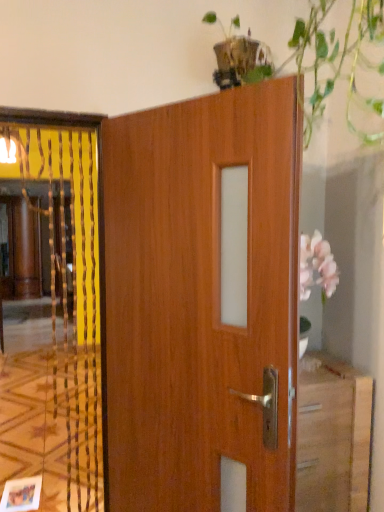
Question: From a real-world perspective, is wooden elevator at left on wooden door at center?

Choices:
 (A) no
 (B) yes

Answer: (A)

Question: Can you confirm if wooden elevator at left is positioned to the right of wooden door at center?

Choices:
 (A) no
 (B) yes

Answer: (A)

Question: Considering the relative sizes of wooden elevator at left and wooden door at center in the image provided, is wooden elevator at left taller than wooden door at center?

Choices:
 (A) yes
 (B) no

Answer: (A)

Question: Does wooden elevator at left contain wooden door at center?

Choices:
 (A) yes
 (B) no

Answer: (B)

Question: Is wooden elevator at left closer to the viewer compared to wooden door at center?

Choices:
 (A) yes
 (B) no

Answer: (B)

Question: Is wooden elevator at left not inside wooden door at center?

Choices:
 (A) no
 (B) yes

Answer: (B)

Question: Is wooden door at center bigger than wooden elevator at left?

Choices:
 (A) yes
 (B) no

Answer: (A)

Question: Is wooden door at center taller than wooden elevator at left?

Choices:
 (A) no
 (B) yes

Answer: (A)

Question: Is wooden door at center looking in the opposite direction of wooden elevator at left?

Choices:
 (A) yes
 (B) no

Answer: (B)

Question: Is wooden elevator at left a part of wooden door at center?

Choices:
 (A) no
 (B) yes

Answer: (A)

Question: From a real-world perspective, does wooden door at center sit lower than wooden elevator at left?

Choices:
 (A) no
 (B) yes

Answer: (A)

Question: Is wooden door at center closer to the viewer compared to wooden elevator at left?

Choices:
 (A) yes
 (B) no

Answer: (A)

Question: Considering the positions of wooden elevator at left and wooden door at center in the image, is wooden elevator at left taller or shorter than wooden door at center?

Choices:
 (A) tall
 (B) short

Answer: (A)